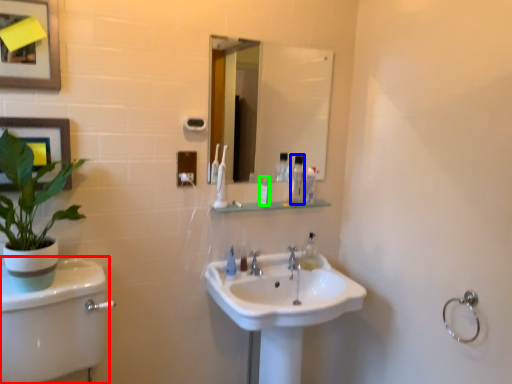
Question: Which is farther away from plain (highlighted by a red box)? mouthwash (highlighted by a blue box) or toiletry (highlighted by a green box)?

Choices:
 (A) mouthwash
 (B) toiletry

Answer: (A)